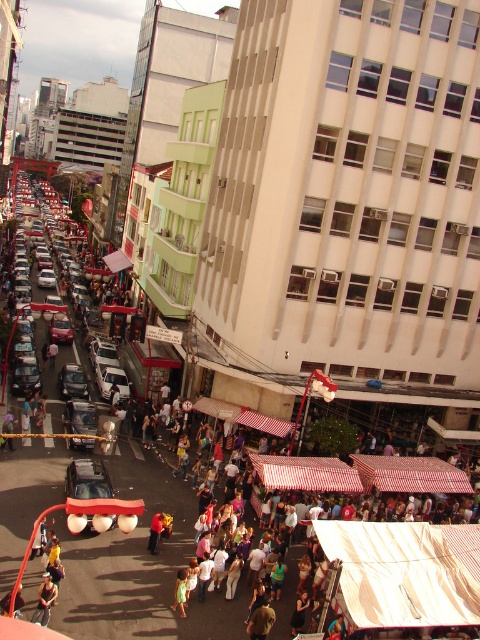
Question: Which of the following is the farthest from the observer?

Choices:
 (A) matte silver sedan at center
 (B) silver metallic van at center
 (C) striped fabric market stall at center
 (D) shiny silver car at center

Answer: (A)

Question: Does striped fabric market stall at center appear under shiny silver car at center?

Choices:
 (A) yes
 (B) no

Answer: (A)

Question: Considering the real-world distances, which object is closest to the red fabric bag at center?

Choices:
 (A) matte silver sedan at center
 (B) silver metallic car at center

Answer: (B)

Question: Can you confirm if silver metallic car at center is positioned to the right of red fabric bag at center?

Choices:
 (A) no
 (B) yes

Answer: (A)

Question: Is white striped fabric canopy at center thinner than matte silver sedan at center?

Choices:
 (A) yes
 (B) no

Answer: (A)

Question: Which object appears farthest from the camera in this image?

Choices:
 (A) striped fabric market stall at center
 (B) red fabric bag at center
 (C) metallic silver car at center

Answer: (C)